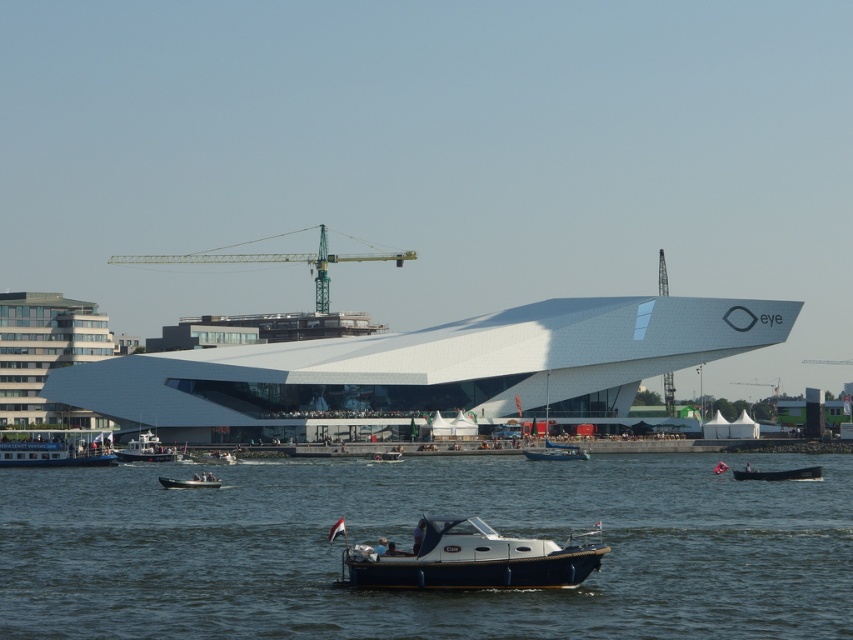
Does transparent blue water at center have a smaller size compared to green metallic crane at center?

Correct, transparent blue water at center occupies less space than green metallic crane at center.

Who is positioned more to the right, transparent blue water at center or green metallic crane at center?

Positioned to the right is transparent blue water at center.

Where is `transparent blue water at center`? The image size is (853, 640). transparent blue water at center is located at coordinates (409, 545).

This screenshot has width=853, height=640. Identify the location of transparent blue water at center. (409, 545).

Who is lower down, blue polished wood boat at center or green metallic crane at center?

blue polished wood boat at center is lower down.

Which of these two, blue polished wood boat at center or green metallic crane at center, stands taller?

With more height is green metallic crane at center.

Who is more forward, (498,541) or (293,260)?

Point (498,541) is more forward.

Where is `blue polished wood boat at center`? The height and width of the screenshot is (640, 853). blue polished wood boat at center is located at coordinates (469, 561).

Is blue polished wood boat at center to the left of white plastic boat at center from the viewer's perspective?

Incorrect, blue polished wood boat at center is not on the left side of white plastic boat at center.

Between blue polished wood boat at center and white plastic boat at center, which one has less height?

white plastic boat at center is shorter.

Where is `blue polished wood boat at center`? This screenshot has height=640, width=853. blue polished wood boat at center is located at coordinates (469, 561).